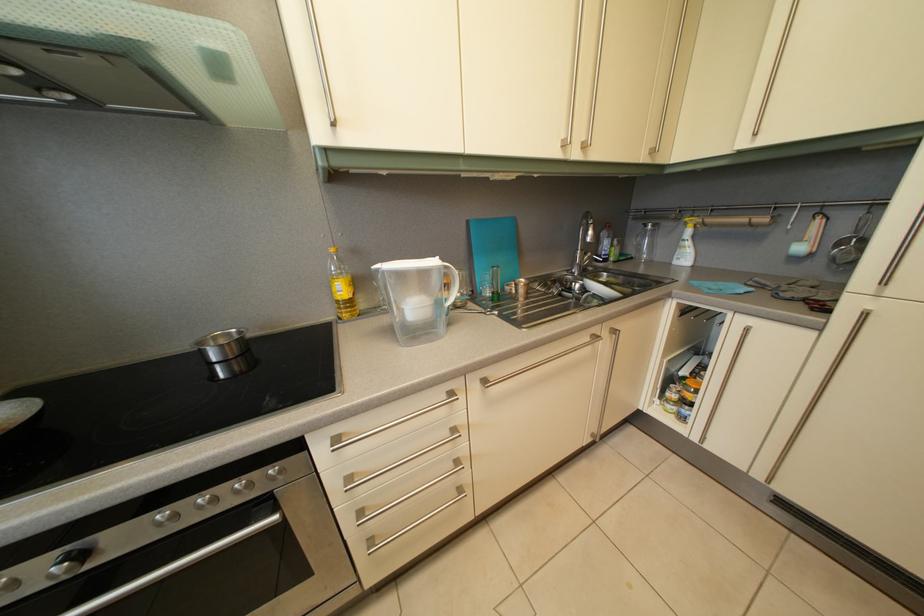
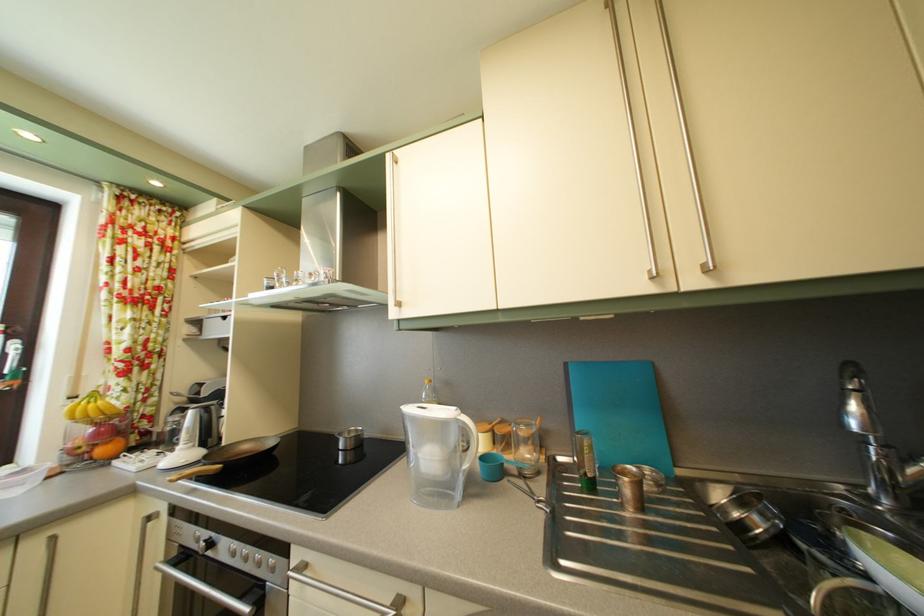
The images are taken continuously from a first-person perspective. In which direction is your viewpoint rotating?

The camera rotated toward left-up.